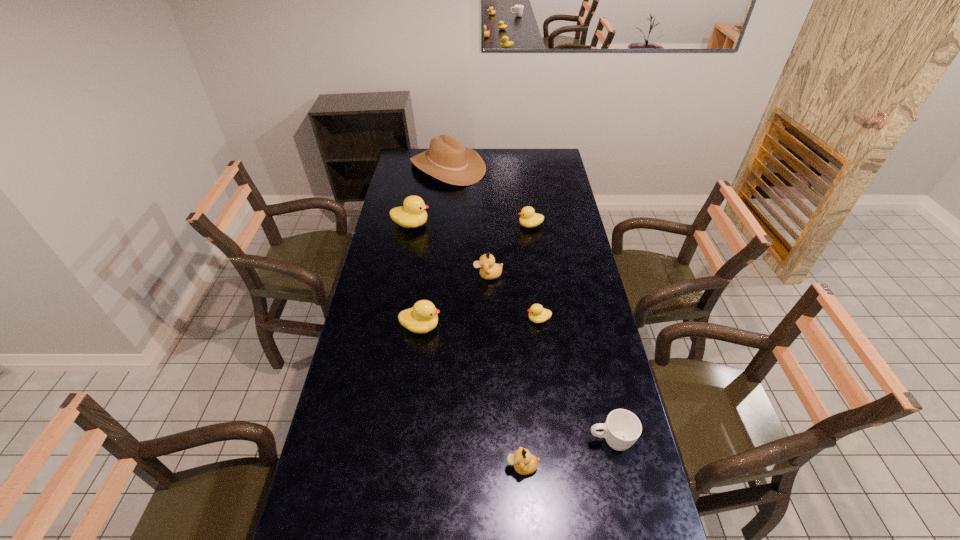
Find the location of `brown cowboy hat`. brown cowboy hat is located at coordinates (447, 159).

In order to click on cowboy hat in this screenshot , I will do `click(447, 159)`.

Identify the location of the biggest yellow duckling. (412, 214).

You are a GUI agent. You are given a task and a screenshot of the screen. Output one action in this format:
    pyautogui.click(x=<x>, y=<y>)
    Task: Click on the third smallest yellow duckling
    This screenshot has width=960, height=540.
    Given the screenshot: What is the action you would take?
    pyautogui.click(x=422, y=317)

The height and width of the screenshot is (540, 960). What are the coordinates of `the third farthest duckling` in the screenshot? It's located at (489, 270).

Where is `the bigger tan duckling`? This screenshot has width=960, height=540. the bigger tan duckling is located at coordinates pyautogui.click(x=489, y=270).

Identify the location of the second smallest yellow duckling. Image resolution: width=960 pixels, height=540 pixels. (530, 219).

The image size is (960, 540). I want to click on cup, so click(x=622, y=428).

Locate an element on the screen. The height and width of the screenshot is (540, 960). the nearer tan duckling is located at coordinates pos(524,463).

Identify the location of the smaller tan duckling. The height and width of the screenshot is (540, 960). (524, 463).